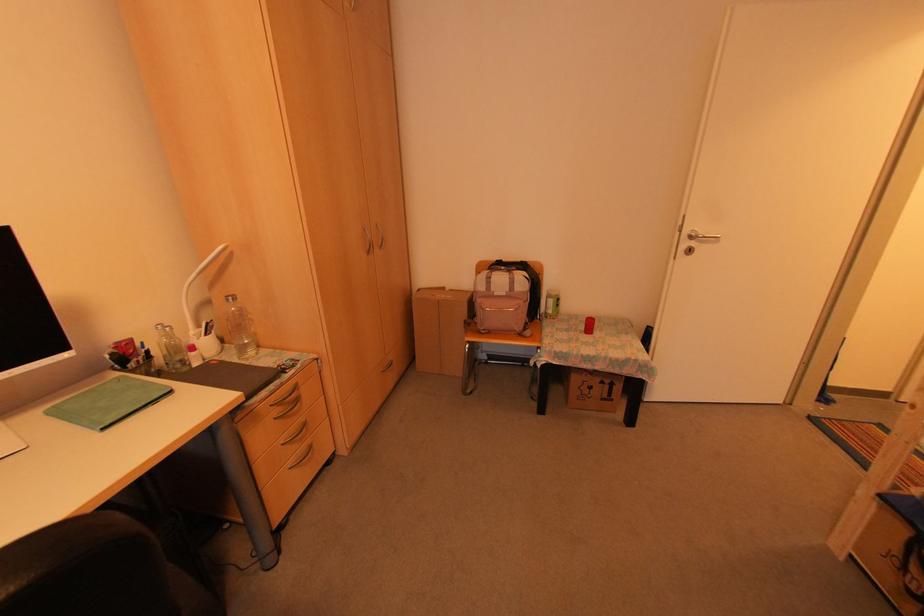
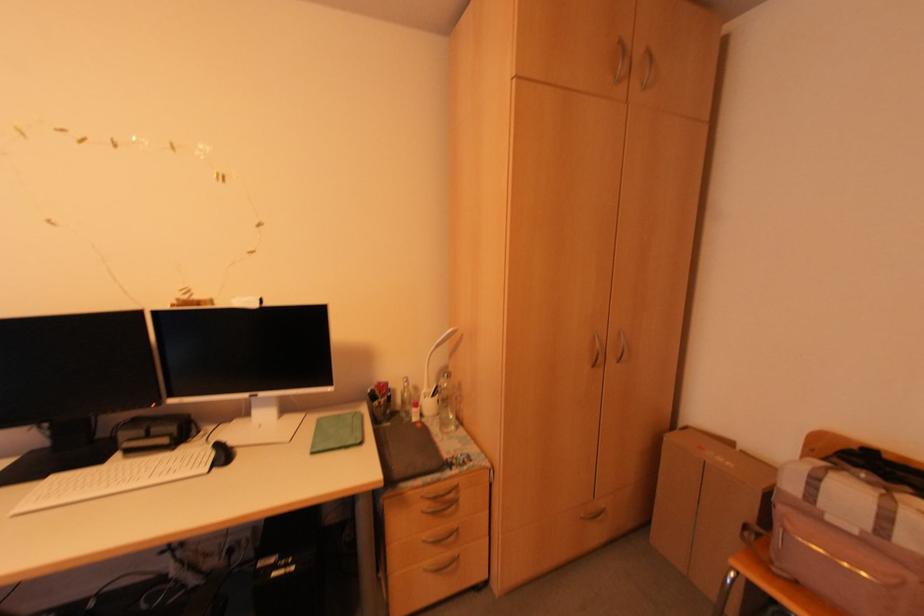
Find the pixel in the second image that matches [309,448] in the first image.

(454, 559)